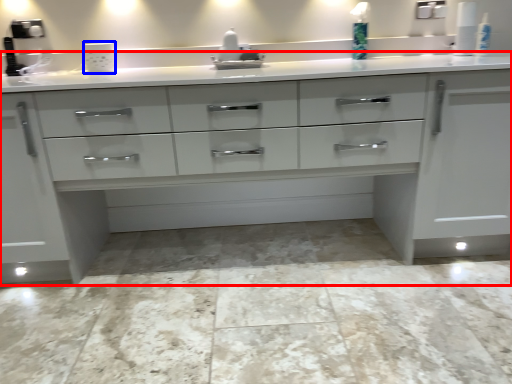
Question: Which of the following is the closest to the observer, chest of drawers (highlighted by a red box) or appliance (highlighted by a blue box)?

Choices:
 (A) chest of drawers
 (B) appliance

Answer: (A)